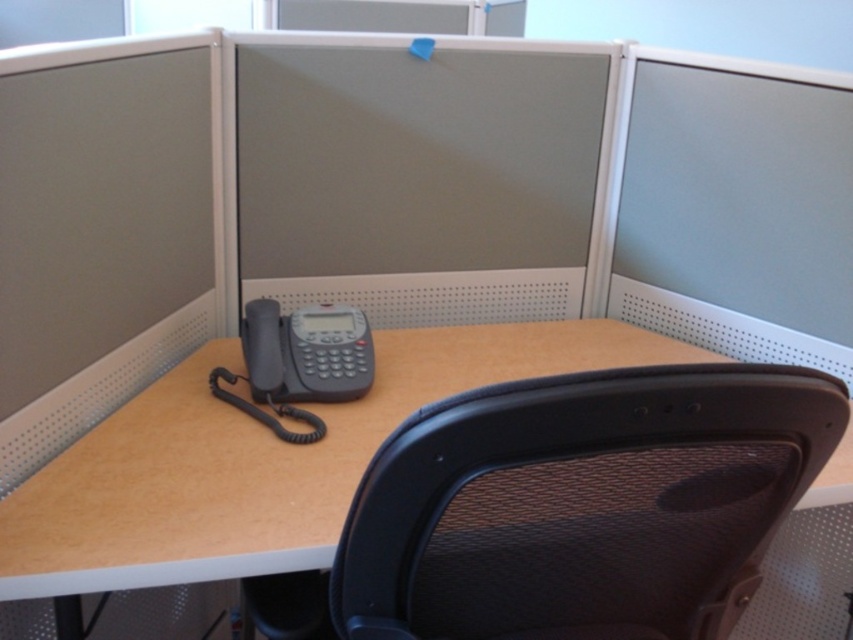
Question: Does matte gray monitor at center appear on the right side of matte gray monitor at upper right?

Choices:
 (A) yes
 (B) no

Answer: (B)

Question: Which object appears closest to the camera in this image?

Choices:
 (A) matte black telephone at center
 (B) matte gray monitor at upper right
 (C) matte gray monitor at center

Answer: (A)

Question: Considering the real-world distances, which object is farthest from the matte gray monitor at center?

Choices:
 (A) matte gray monitor at upper right
 (B) matte black telephone at center

Answer: (A)

Question: Which of these objects is positioned farthest from the matte gray monitor at center?

Choices:
 (A) matte black telephone at center
 (B) matte gray monitor at upper right

Answer: (B)

Question: In this image, where is matte gray monitor at center located relative to matte gray monitor at upper right?

Choices:
 (A) right
 (B) left

Answer: (B)

Question: Is matte black telephone at center in front of matte gray monitor at upper right?

Choices:
 (A) yes
 (B) no

Answer: (A)